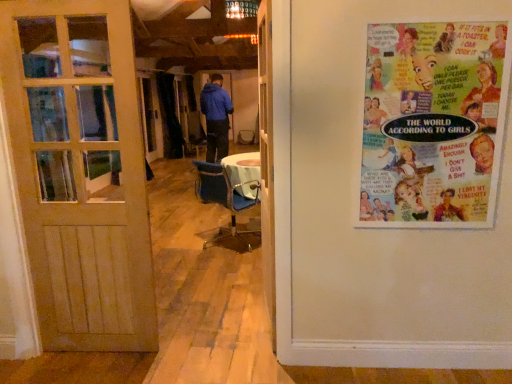
This screenshot has width=512, height=384. What are the coordinates of `empty space that is ontop of wooden door at left, placed as the second door when sorted from right to left (from a real-world perspective)` in the screenshot? It's located at (53, 1).